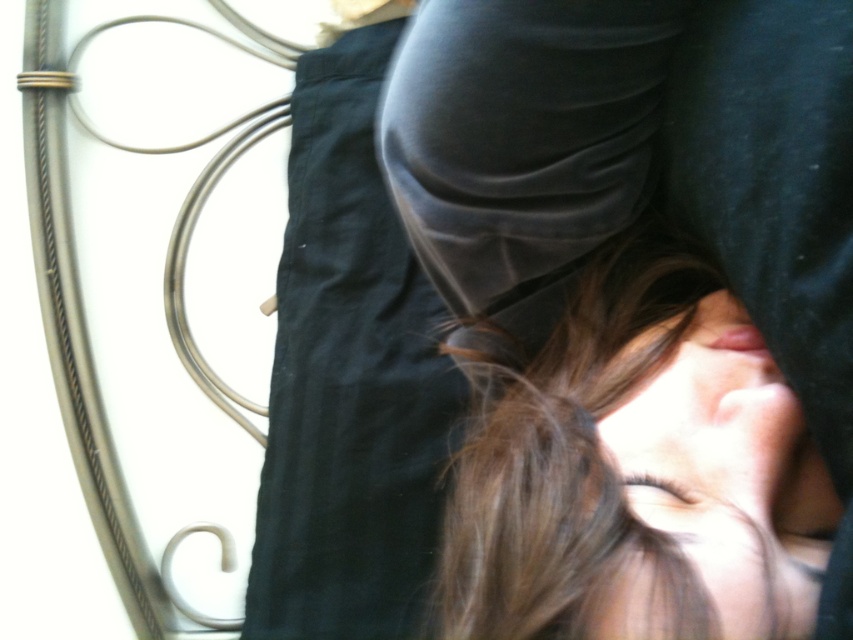
Is smooth black fabric at center positioned in front of brown matte hair at center?

No.

Is the position of smooth black fabric at center more distant than that of brown matte hair at center?

Yes.

At what (x,y) coordinates should I click in order to perform the action: click on smooth black fabric at center. Please return your answer as a coordinate pair (x, y). This screenshot has height=640, width=853. Looking at the image, I should click on (521, 132).

From the picture: Does smooth black fabric at center come behind matte black face at center?

That is True.

What do you see at coordinates (521, 132) in the screenshot? This screenshot has height=640, width=853. I see `smooth black fabric at center` at bounding box center [521, 132].

Where is `smooth black fabric at center`? smooth black fabric at center is located at coordinates (521, 132).

Between point (526, 612) and point (666, 445), which one is positioned in front?

Point (526, 612) is more forward.

Does point (527, 474) come in front of point (792, 545)?

Yes, it is.

Locate an element on the screen. The width and height of the screenshot is (853, 640). brown matte hair at center is located at coordinates (564, 461).